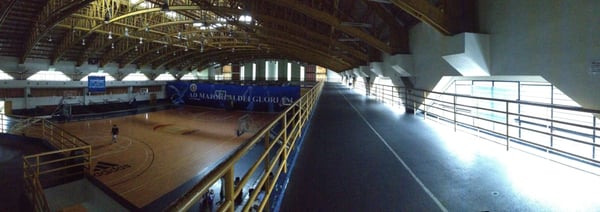
Locate an element on the screen. glass doors is located at coordinates (493, 81).